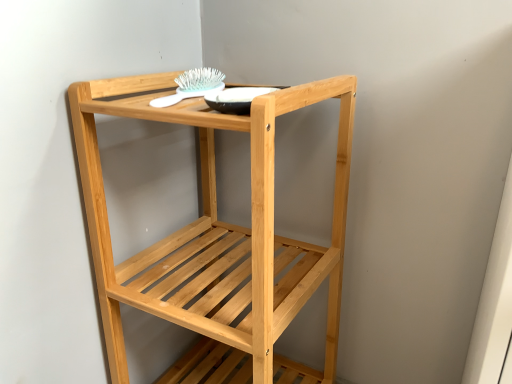
Question: Can you confirm if natural wood shelf at center is wider than matte black bowl at upper center?

Choices:
 (A) yes
 (B) no

Answer: (A)

Question: Does natural wood shelf at center come in front of matte black bowl at upper center?

Choices:
 (A) no
 (B) yes

Answer: (B)

Question: Is natural wood shelf at center oriented towards matte black bowl at upper center?

Choices:
 (A) no
 (B) yes

Answer: (A)

Question: Does natural wood shelf at center appear on the right side of matte black bowl at upper center?

Choices:
 (A) yes
 (B) no

Answer: (B)

Question: Is natural wood shelf at center smaller than matte black bowl at upper center?

Choices:
 (A) no
 (B) yes

Answer: (A)

Question: Is white plastic brush at upper center situated inside matte black bowl at upper center or outside?

Choices:
 (A) outside
 (B) inside

Answer: (A)

Question: Looking at the image, does white plastic brush at upper center seem bigger or smaller compared to matte black bowl at upper center?

Choices:
 (A) big
 (B) small

Answer: (A)

Question: From their relative heights in the image, would you say white plastic brush at upper center is taller or shorter than matte black bowl at upper center?

Choices:
 (A) short
 (B) tall

Answer: (B)

Question: Considering the positions of point (190, 77) and point (239, 100), is point (190, 77) closer or farther from the camera than point (239, 100)?

Choices:
 (A) closer
 (B) farther

Answer: (B)

Question: Choose the correct answer: Is matte black bowl at upper center inside white plastic brush at upper center or outside it?

Choices:
 (A) inside
 (B) outside

Answer: (B)

Question: Is point coord(224,105) closer or farther from the camera than point coord(165,104)?

Choices:
 (A) closer
 (B) farther

Answer: (A)

Question: In the image, is matte black bowl at upper center positioned in front of or behind white plastic brush at upper center?

Choices:
 (A) front
 (B) behind

Answer: (A)

Question: From the image's perspective, is matte black bowl at upper center located above or below white plastic brush at upper center?

Choices:
 (A) above
 (B) below

Answer: (B)

Question: From the image's perspective, is natural wood shelf at center located above or below white plastic brush at upper center?

Choices:
 (A) below
 (B) above

Answer: (A)

Question: Do you think natural wood shelf at center is within white plastic brush at upper center, or outside of it?

Choices:
 (A) outside
 (B) inside

Answer: (A)